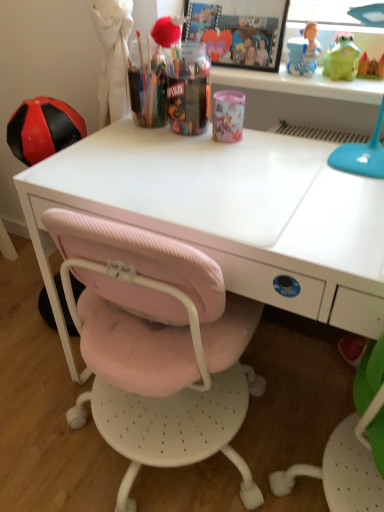
I want to click on vacant space situated on the left part of pink glossy cup at center, the 1th stationery positioned from the right, so click(x=158, y=145).